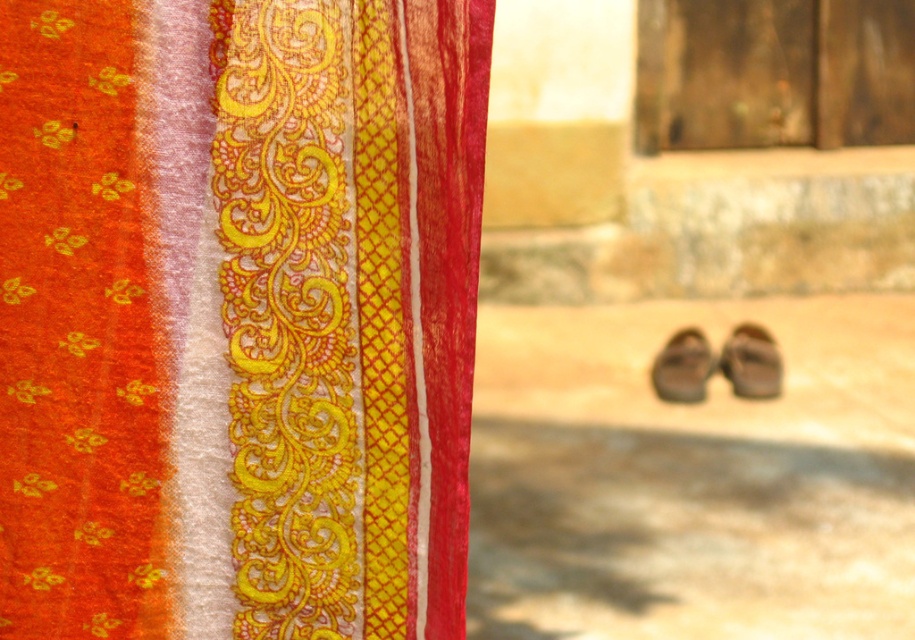
Question: Which point is farther to the camera?

Choices:
 (A) brown leather shoe at center
 (B) matte gold fabric at upper left
 (C) brown leather shoe at lower right

Answer: (C)

Question: Can you confirm if matte gold fabric at upper left is bigger than brown leather shoe at lower right?

Choices:
 (A) no
 (B) yes

Answer: (A)

Question: Is matte gold fabric at upper left positioned at the back of brown leather shoe at lower right?

Choices:
 (A) no
 (B) yes

Answer: (A)

Question: Based on their relative distances, which object is farther from the matte gold fabric at upper left?

Choices:
 (A) brown leather shoe at lower right
 (B) brown leather shoe at center

Answer: (A)

Question: Is brown leather shoe at lower right to the right of brown leather shoe at center from the viewer's perspective?

Choices:
 (A) no
 (B) yes

Answer: (B)

Question: Which object is farther from the camera taking this photo?

Choices:
 (A) brown leather shoe at lower right
 (B) brown leather shoe at center

Answer: (A)